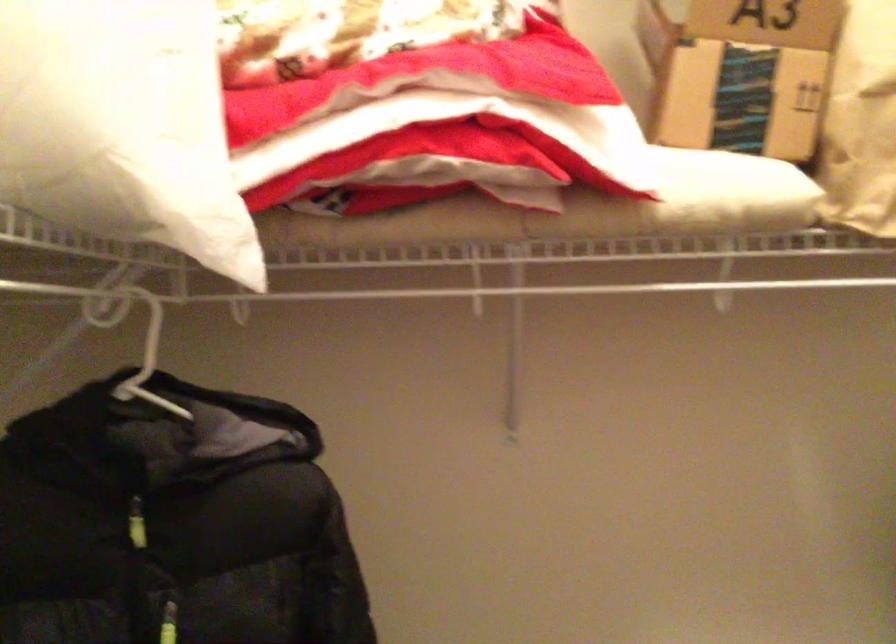
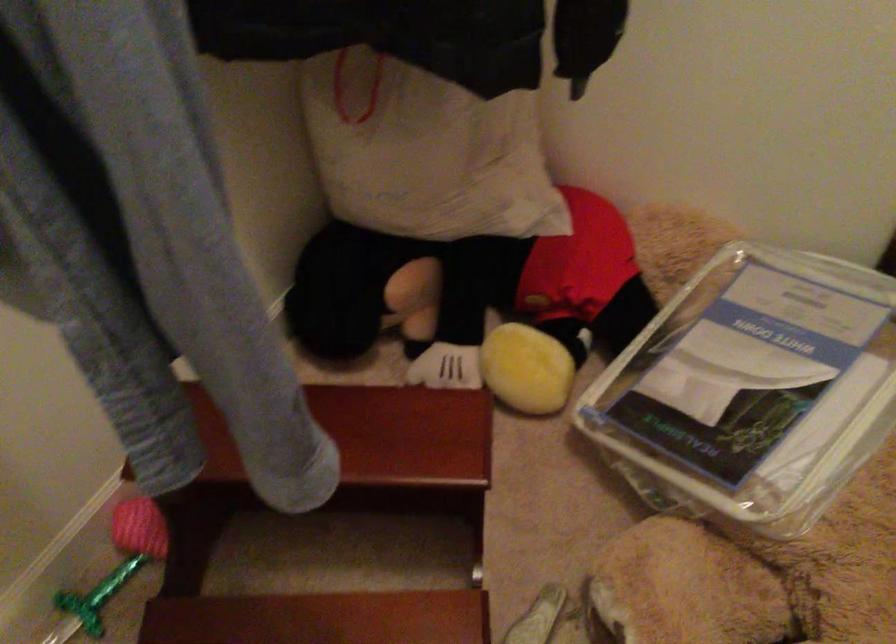
How did the camera likely rotate?

The camera rotated toward left-down.